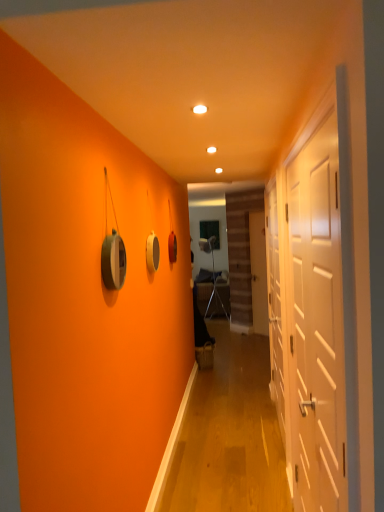
Question: Based on their sizes in the image, would you say white glossy door at right, the third door from the back, is bigger or smaller than white matte door at right, which is the second door from back to front?

Choices:
 (A) big
 (B) small

Answer: (B)

Question: In the image, is white glossy door at right, placed as the 1th door when sorted from left to right, on the left side or the right side of white matte door at right, positioned as the second door in right-to-left order?

Choices:
 (A) right
 (B) left

Answer: (B)

Question: Estimate the real-world distances between objects in this image. Which object is closer to the metallic silver armchair at center?

Choices:
 (A) white matte door at center, placed as the third door when sorted from left to right
 (B) white glossy door at right, the third door from the back
 (C) white matte door at right, the second door viewed from the front

Answer: (A)

Question: Which object is positioned closest to the white matte door at right, the second door viewed from the left?

Choices:
 (A) white matte door at center, which is the 3th door from front to back
 (B) white glossy door at right, the third door from the back
 (C) metallic silver armchair at center

Answer: (B)